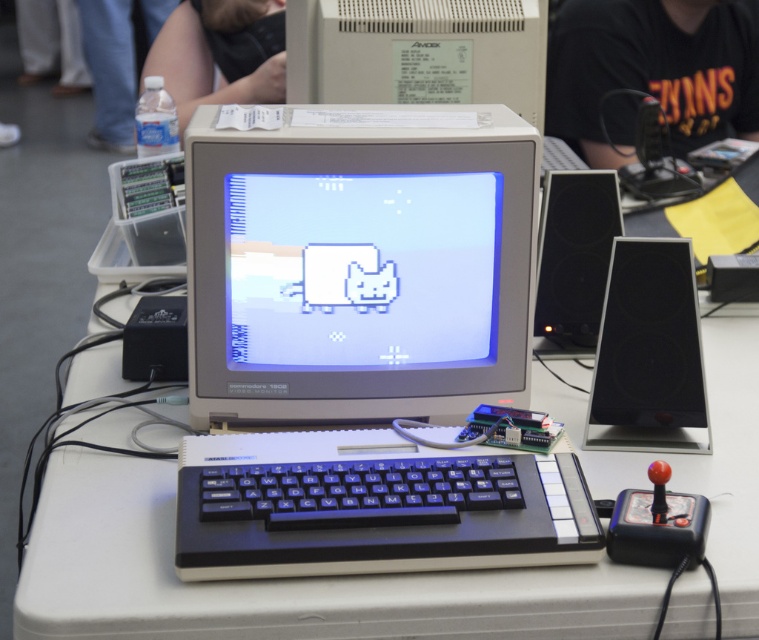
Does matte gray monitor at center have a lesser width compared to black plastic keyboard at center?

No, matte gray monitor at center is not thinner than black plastic keyboard at center.

Does matte gray monitor at center appear on the left side of black plastic keyboard at center?

Indeed, matte gray monitor at center is positioned on the left side of black plastic keyboard at center.

Is point (468, 538) behind point (279, 561)?

That is True.

Image resolution: width=759 pixels, height=640 pixels. I want to click on matte gray monitor at center, so click(x=357, y=262).

Is point (476, 124) positioned after point (487, 96)?

No, it is not.

Locate an element on the screen. This screenshot has width=759, height=640. matte gray monitor at center is located at coordinates (357, 262).

Who is taller, black plastic keyboard at center or white plastic computer monitor at upper center?

With more height is white plastic computer monitor at upper center.

Which is in front, point (361, 545) or point (509, 74)?

Point (361, 545) is more forward.

The image size is (759, 640). Find the location of `black plastic keyboard at center`. black plastic keyboard at center is located at coordinates (383, 516).

Identify the location of black plastic keyboard at center. This screenshot has height=640, width=759. (x=383, y=516).